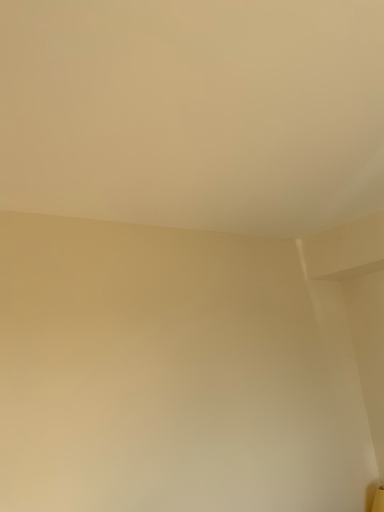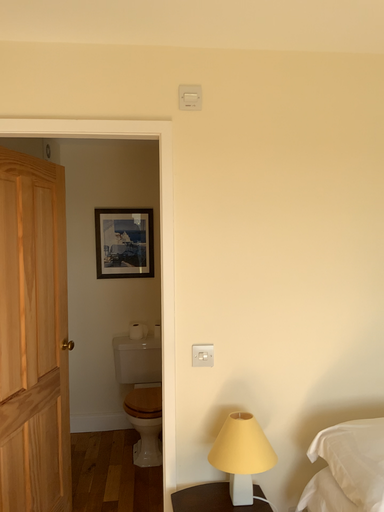
Question: Which way did the camera rotate in the video?

Choices:
 (A) rotated upward
 (B) rotated downward

Answer: (B)